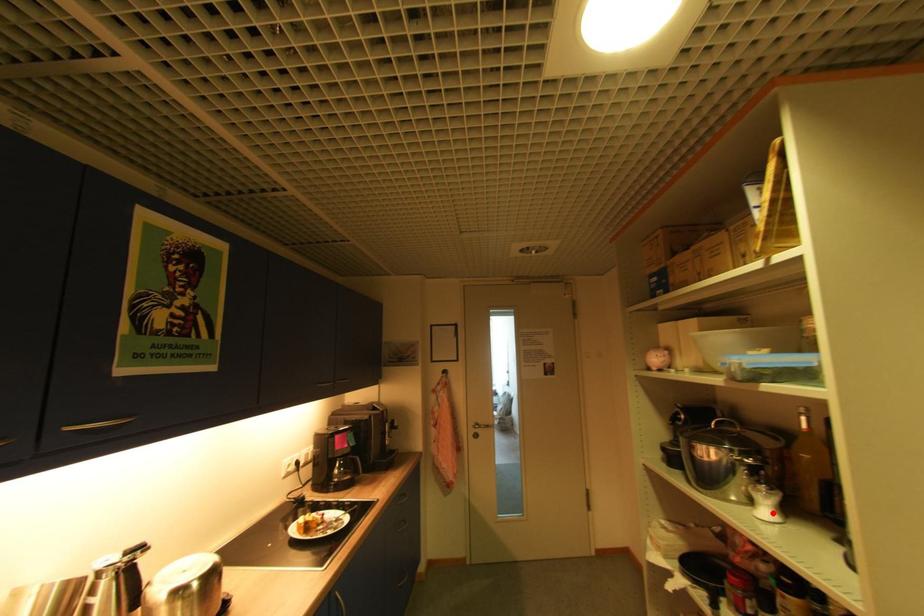
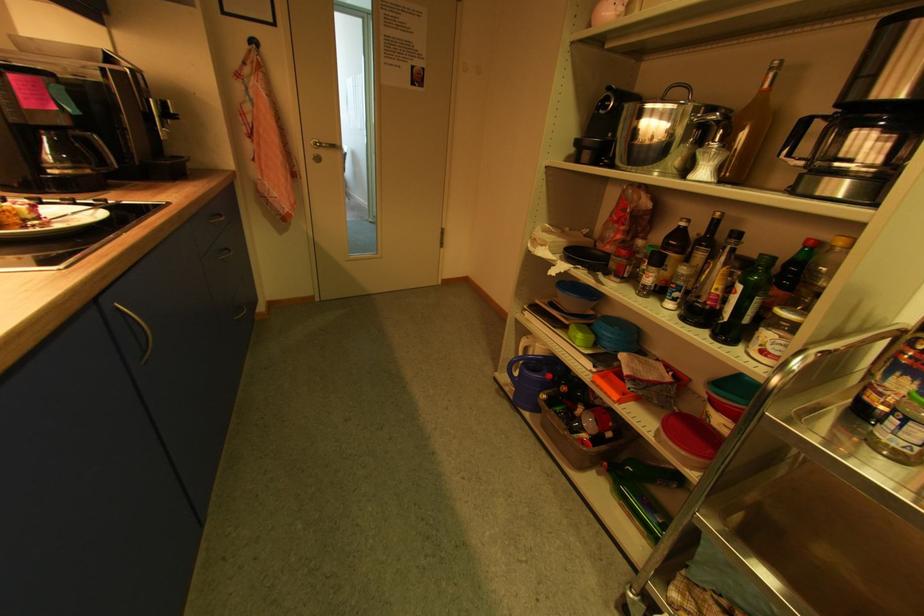
Find the pixel in the second image that matches the highlighted location in the first image.

(709, 175)